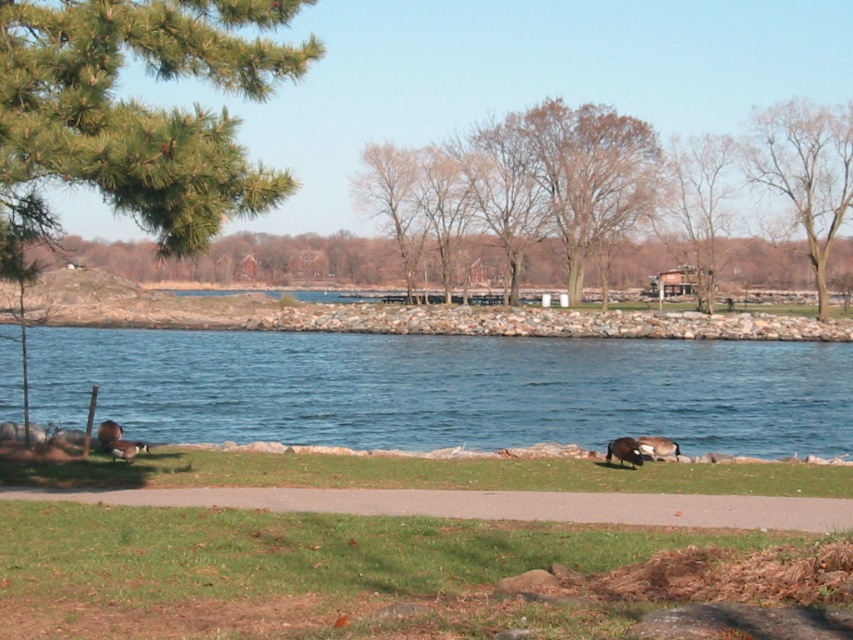
Which is above, green grass at lower center or brown fuzzy duck at lower center?

Positioned higher is green grass at lower center.

Which is more to the left, green grass at lower center or brown fuzzy duck at lower center?

Positioned to the left is green grass at lower center.

Locate an element on the screen. Image resolution: width=853 pixels, height=640 pixels. green grass at lower center is located at coordinates (379, 573).

Find the location of a particular element. This screenshot has width=853, height=640. green grass at lower center is located at coordinates tap(379, 573).

Can you confirm if green grass at lower center is bigger than brown fuzzy duck at lower left?

No, green grass at lower center is not bigger than brown fuzzy duck at lower left.

Find the location of a particular element. The image size is (853, 640). green grass at lower center is located at coordinates (379, 573).

Can you confirm if blue water at lower left is positioned to the left of gray fuzzy duck at center?

Indeed, blue water at lower left is positioned on the left side of gray fuzzy duck at center.

Does blue water at lower left appear under gray fuzzy duck at center?

Actually, blue water at lower left is above gray fuzzy duck at center.

Is point (242, 420) closer to viewer compared to point (665, 448)?

That is False.

Locate an element on the screen. blue water at lower left is located at coordinates (445, 388).